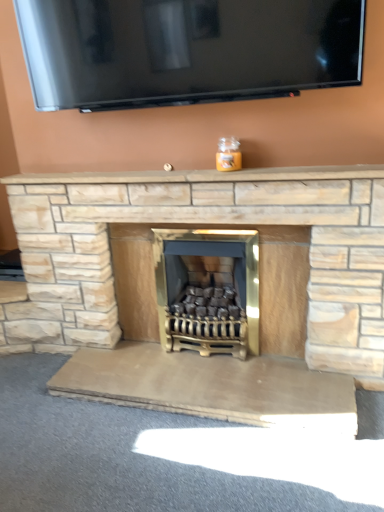
At what (x,y) coordinates should I click in order to perform the action: click on beige stone mantle at center. Please return your answer as a coordinate pair (x, y). This screenshot has width=384, height=512. Looking at the image, I should click on (202, 175).

Find the location of a particular element. Image resolution: width=384 pixels, height=512 pixels. natural stone fireplace at center is located at coordinates (202, 224).

Looking at their sizes, would you say gold metallic wood burning stove at center is wider or thinner than beige stone mantle at center?

Clearly, gold metallic wood burning stove at center has more width compared to beige stone mantle at center.

Is gold metallic wood burning stove at center far from beige stone mantle at center?

No.

Is gold metallic wood burning stove at center facing towards beige stone mantle at center?

No, gold metallic wood burning stove at center is not turned towards beige stone mantle at center.

What's the angular difference between gold metallic wood burning stove at center and beige stone mantle at center's facing directions?

They differ by 0.00172 degrees in their facing directions.

Looking at the image, does beige stone mantle at center seem bigger or smaller compared to gold metallic wood burning stove at center?

Clearly, beige stone mantle at center is smaller in size than gold metallic wood burning stove at center.

Which of these two, beige stone mantle at center or gold metallic wood burning stove at center, is wider?

gold metallic wood burning stove at center is wider.

Identify the location of wood burning stove beneath the beige stone mantle at center (from a real-world perspective). (208, 290).

Is beige stone mantle at center not near gold metallic wood burning stove at center?

Actually, beige stone mantle at center and gold metallic wood burning stove at center are a little close together.

Is gold metallic wood burning stove at center far from natural stone fireplace at center?

No, gold metallic wood burning stove at center is not far from natural stone fireplace at center.

At what (x,y) coordinates should I click in order to perform the action: click on fireplace lying in front of the gold metallic wood burning stove at center. Please return your answer as a coordinate pair (x, y). Image resolution: width=384 pixels, height=512 pixels. Looking at the image, I should click on 202,224.

From the image's perspective, would you say gold metallic wood burning stove at center is positioned over natural stone fireplace at center?

Incorrect, from the image's perspective, gold metallic wood burning stove at center is lower than natural stone fireplace at center.

Does gold metallic wood burning stove at center have a smaller size compared to natural stone fireplace at center?

Indeed, gold metallic wood burning stove at center has a smaller size compared to natural stone fireplace at center.

How different are the orientations of natural stone fireplace at center and beige stone mantle at center in degrees?

0.00507 degrees separate the facing orientations of natural stone fireplace at center and beige stone mantle at center.

From the image's perspective, is natural stone fireplace at center below beige stone mantle at center?

Yes.

From a real-world perspective, is natural stone fireplace at center above or below beige stone mantle at center?

In terms of real-world spatial position, natural stone fireplace at center is below beige stone mantle at center.

Identify the location of fireplace below the beige stone mantle at center (from a real-world perspective). (202, 224).

At what (x,y) coordinates should I click in order to perform the action: click on fireplace that is under the beige stone mantle at center (from a real-world perspective). Please return your answer as a coordinate pair (x, y). Looking at the image, I should click on (202, 224).

Between beige stone mantle at center and natural stone fireplace at center, which one has less height?

beige stone mantle at center is shorter.

Can you see beige stone mantle at center touching natural stone fireplace at center?

No, beige stone mantle at center is not beside natural stone fireplace at center.

Is beige stone mantle at center bigger than natural stone fireplace at center?

No, beige stone mantle at center is not bigger than natural stone fireplace at center.

Measure the distance between natural stone fireplace at center and gold metallic wood burning stove at center.

A distance of 30.98 centimeters exists between natural stone fireplace at center and gold metallic wood burning stove at center.

Between natural stone fireplace at center and gold metallic wood burning stove at center, which one has less height?

With less height is gold metallic wood burning stove at center.

Considering the positions of objects natural stone fireplace at center and gold metallic wood burning stove at center in the image provided, who is more to the right, natural stone fireplace at center or gold metallic wood burning stove at center?

gold metallic wood burning stove at center.

Between point (80, 309) and point (244, 275), which one is positioned behind?

Positioned behind is point (80, 309).

Find the location of a particular element. Image resolution: width=384 pixels, height=512 pixels. wood burning stove on the right side of beige stone mantle at center is located at coordinates (208, 290).

What are the coordinates of `mantle on the left of gold metallic wood burning stove at center` in the screenshot? It's located at (202, 175).

From the image, which object appears to be nearer to natural stone fireplace at center, gold metallic wood burning stove at center or beige stone mantle at center?

beige stone mantle at center is closer to natural stone fireplace at center.

Which object lies nearer to the anchor point gold metallic wood burning stove at center, beige stone mantle at center or natural stone fireplace at center?

natural stone fireplace at center is positioned closer to the anchor gold metallic wood burning stove at center.

Considering their positions, is beige stone mantle at center positioned closer to natural stone fireplace at center than gold metallic wood burning stove at center?

beige stone mantle at center is closer to natural stone fireplace at center.

Estimate the real-world distances between objects in this image. Which object is further from beige stone mantle at center, gold metallic wood burning stove at center or natural stone fireplace at center?

The object further to beige stone mantle at center is gold metallic wood burning stove at center.

Looking at the image, which one is located further to gold metallic wood burning stove at center, natural stone fireplace at center or beige stone mantle at center?

beige stone mantle at center is positioned further to the anchor gold metallic wood burning stove at center.

Based on their spatial positions, is natural stone fireplace at center or gold metallic wood burning stove at center closer to beige stone mantle at center?

natural stone fireplace at center lies closer to beige stone mantle at center than the other object.

I want to click on fireplace between beige stone mantle at center and gold metallic wood burning stove at center from top to bottom, so click(x=202, y=224).